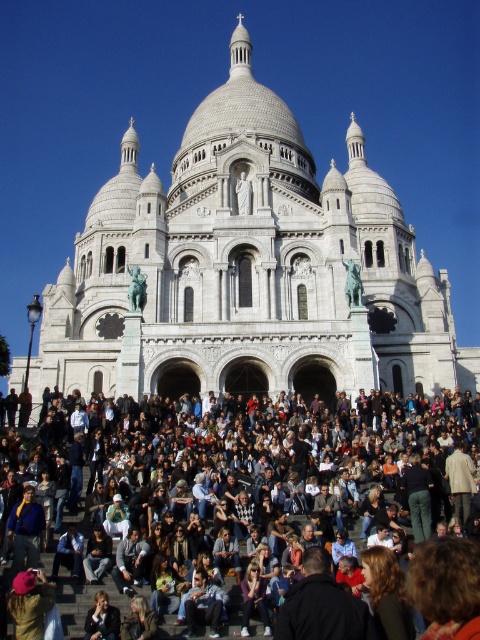
You are a photographer standing at the base of the steps of the Sacre Coeur Basilica. You want to take a photo of the light brown leather jacket at lower center but there is a multicolored fabric crowd at center in the way. Can you see the jacket from your current position?

The multicolored fabric crowd at center has a greater height compared to the light brown leather jacket at lower center, so the crowd is blocking the view of the jacket.

You are standing at the entrance of the Sacre Coeur and want to take a photo of the white stone church at center. Where should you position yourself to capture the church in the center of your frame?

The white stone church at center is located at point (248,268), so you should position yourself directly in front of it to ensure it is centered in your photo.

You are standing at the bottom of the steps leading up to the Sacre Coeur basilica and notice a person wearing a brown leather jacket at lower center. You want to find them in the crowd. Which direction should you look relative to the multicolored fabric crowd at center?

The brown leather jacket at lower center is to the left of the multicolored fabric crowd at center, so look to the left side of the crowd.